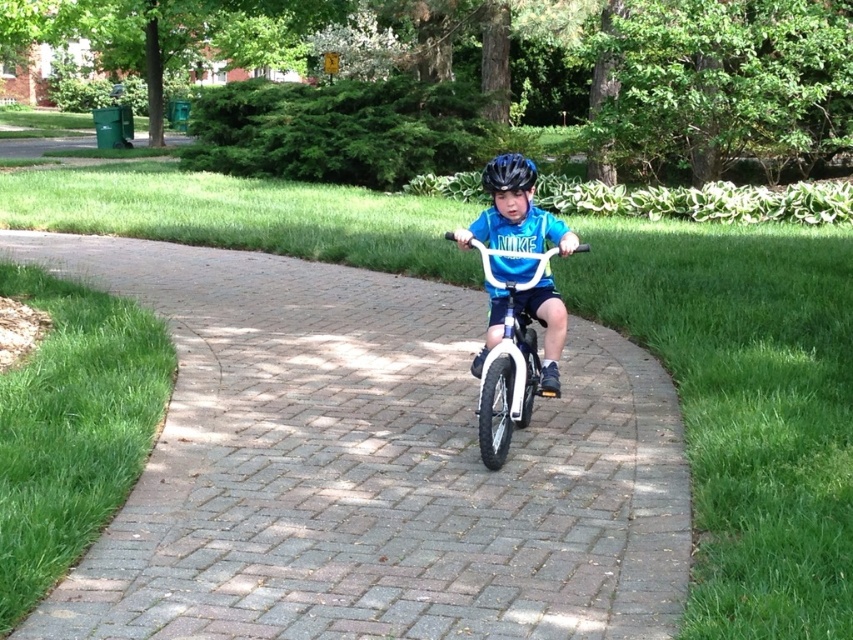
You are standing at the starting point of the path and want to reach the end. Which point, point (581,625) or point (459,236), is closer to you as you begin your journey?

Point (581,625) is closer to the viewer than point (459,236), so you would reach point (581,625) first on your journey.